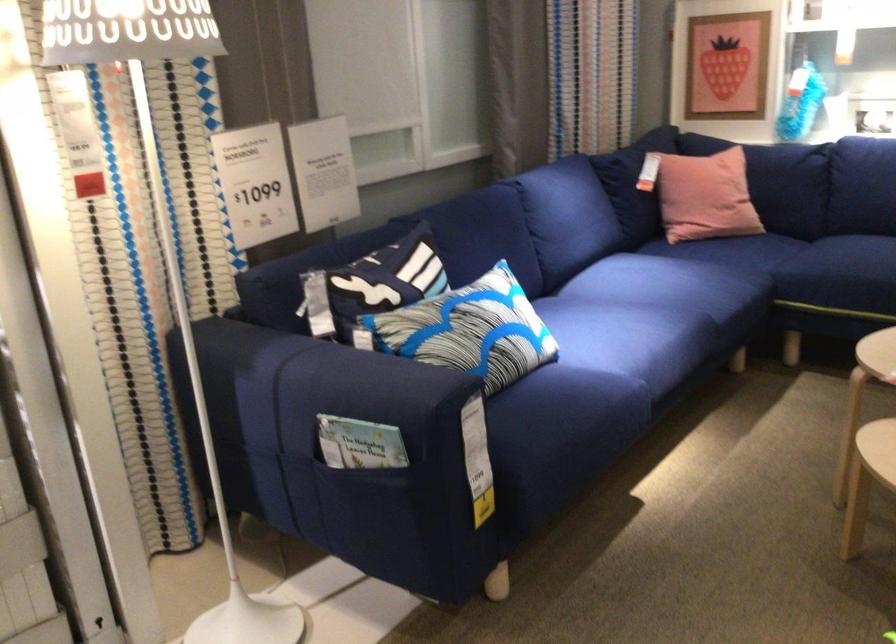
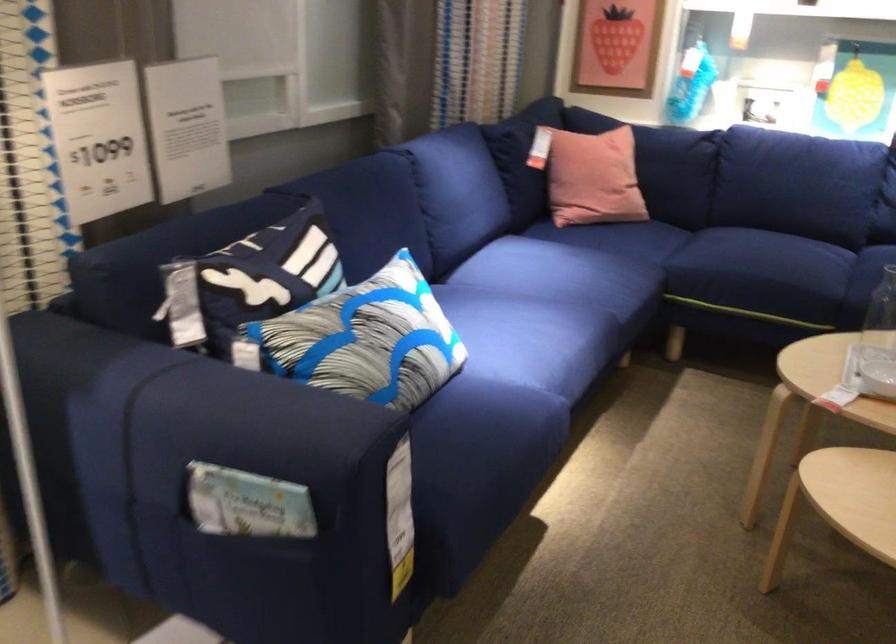
Question: The camera is either moving clockwise (left) or counter-clockwise (right) around the object. The first image is from the beginning of the video and the second image is from the end. Is the camera moving left or right when shooting the video?

Choices:
 (A) Left
 (B) Right

Answer: (A)